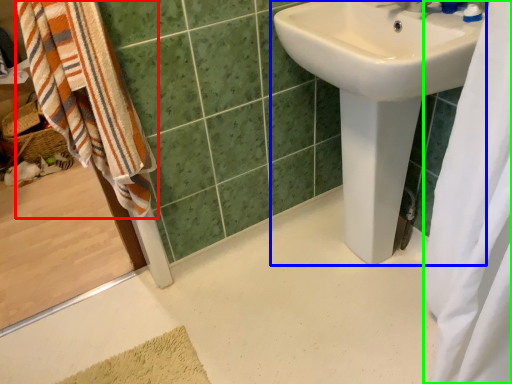
Question: Based on their relative distances, which object is farther from beach towel (highlighted by a red box)? Choose from sink (highlighted by a blue box) and shower curtain (highlighted by a green box).

Choices:
 (A) sink
 (B) shower curtain

Answer: (B)